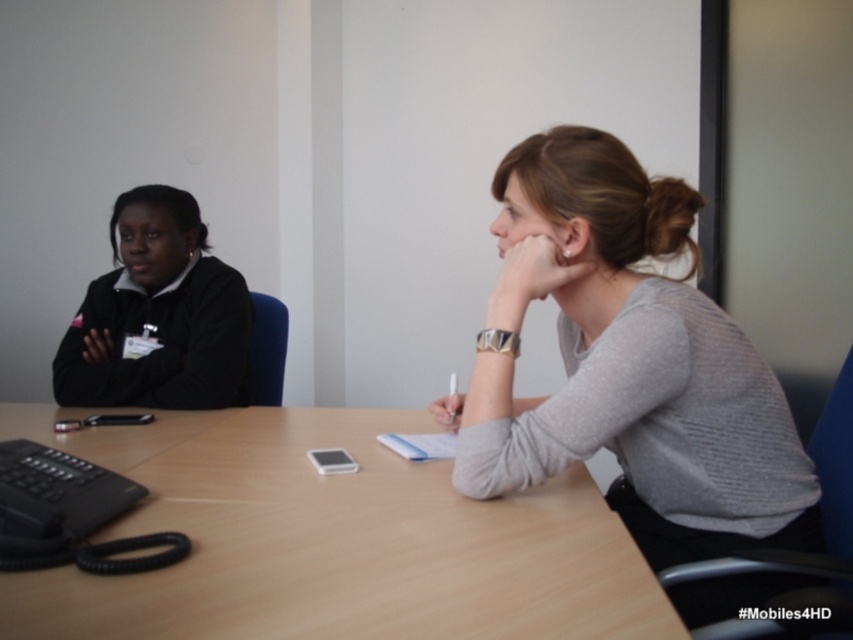
Question: Does light brown wood table at center appear on the left side of black matte jacket at left?

Choices:
 (A) yes
 (B) no

Answer: (B)

Question: Among these points, which one is farthest from the camera?

Choices:
 (A) (648, 493)
 (B) (383, 518)
 (C) (195, 308)

Answer: (C)

Question: Which of these objects is positioned closest to the black matte jacket at left?

Choices:
 (A) light brown wood table at center
 (B) gray sweater at center

Answer: (A)

Question: Which point is closer to the camera taking this photo?

Choices:
 (A) (764, 408)
 (B) (538, 611)

Answer: (B)

Question: Is gray sweater at center below black matte jacket at left?

Choices:
 (A) no
 (B) yes

Answer: (B)

Question: Is light brown wood table at center to the right of black matte jacket at left from the viewer's perspective?

Choices:
 (A) no
 (B) yes

Answer: (B)